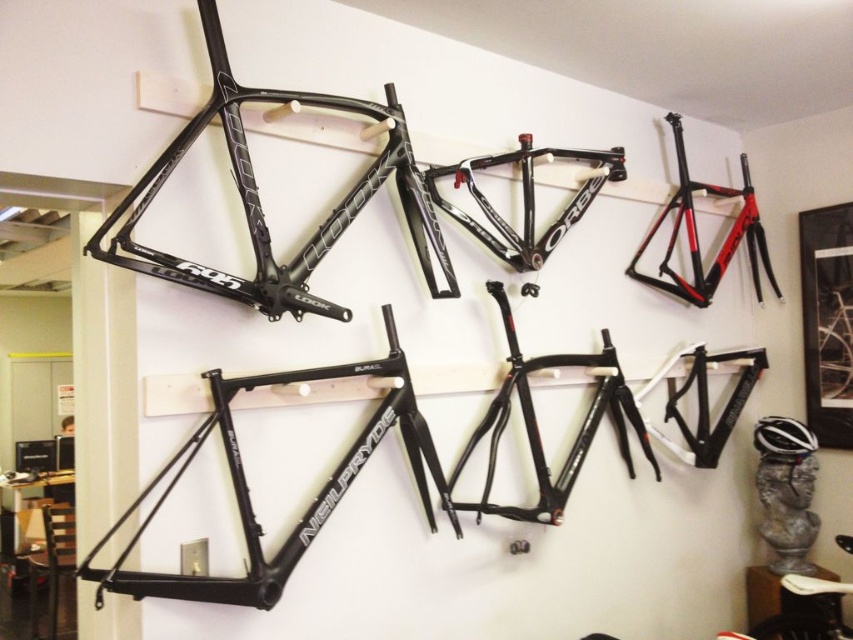
What are the coordinates of the black matte bicycle frame at center?

The black matte bicycle frame at center is located at coordinates point (369, 456).

You are an art curator planning to photograph the black matte bicycle frame at center and the matte black frame at upper center. Since both are mounted on the same wall, will you need to adjust your camera angle to capture both frames without one blocking the other?

The black matte bicycle frame at center is in front of the matte black frame at upper center, so you will need to adjust your camera angle to capture both frames without one blocking the other.